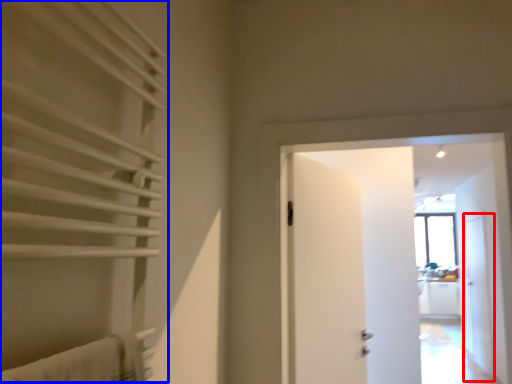
Question: Among these objects, which one is farthest to the camera, screen door (highlighted by a red box) or curtain (highlighted by a blue box)?

Choices:
 (A) screen door
 (B) curtain

Answer: (A)